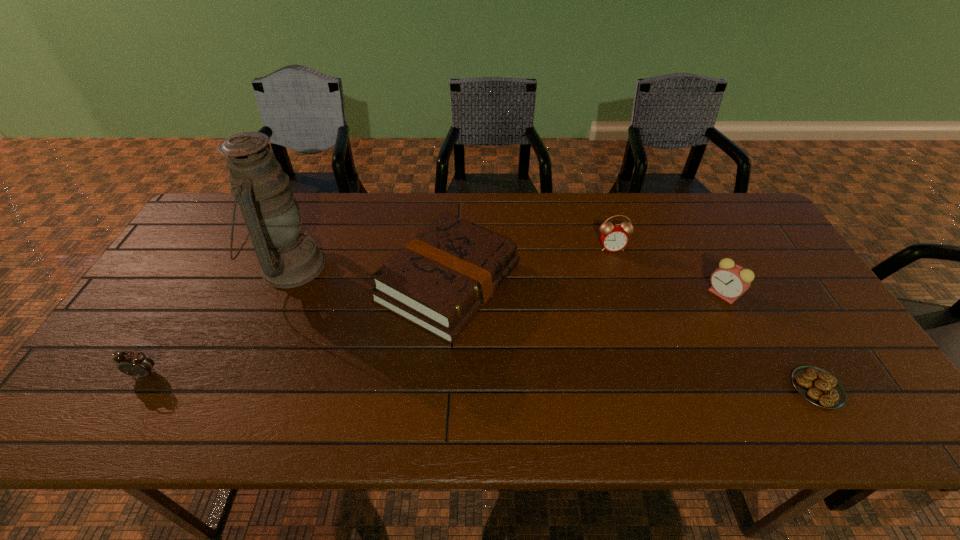
Locate an element on the screen. the closest alarm clock to the leftmost object is located at coordinates (614, 238).

You are a GUI agent. You are given a task and a screenshot of the screen. Output one action in this format:
    pyautogui.click(x=<x>, y=<y>)
    Task: Click on the alarm clock that is the second closest to the farthest alarm clock
    
    Given the screenshot: What is the action you would take?
    pyautogui.click(x=136, y=364)

Locate an element on the screen. This screenshot has width=960, height=540. free spot that satisfies the following two spatial constraints: 1. on the face of the rightmost object; 2. on the right side of the rightmost alarm clock is located at coordinates (771, 388).

The width and height of the screenshot is (960, 540). Find the location of `free space that satisfies the following two spatial constraints: 1. on the face of the rightmost alarm clock; 2. on the face of the nearest alarm clock`. free space that satisfies the following two spatial constraints: 1. on the face of the rightmost alarm clock; 2. on the face of the nearest alarm clock is located at coordinates (763, 374).

I want to click on free space in the image that satisfies the following two spatial constraints: 1. on the front side of the pastry; 2. on the left side of the third object from left to right, so click(442, 388).

Find the location of a particular element. free space that satisfies the following two spatial constraints: 1. on the clock face of the fourth object from left to right; 2. on the right side of the shortest object is located at coordinates (655, 388).

Identify the location of free spot that satisfies the following two spatial constraints: 1. on the face of the second farthest alarm clock; 2. on the face of the leftmost object. (763, 374).

Find the location of `vacant region that satisfies the following two spatial constraints: 1. on the face of the rightmost alarm clock; 2. on the back side of the rightmost object`. vacant region that satisfies the following two spatial constraints: 1. on the face of the rightmost alarm clock; 2. on the back side of the rightmost object is located at coordinates (771, 388).